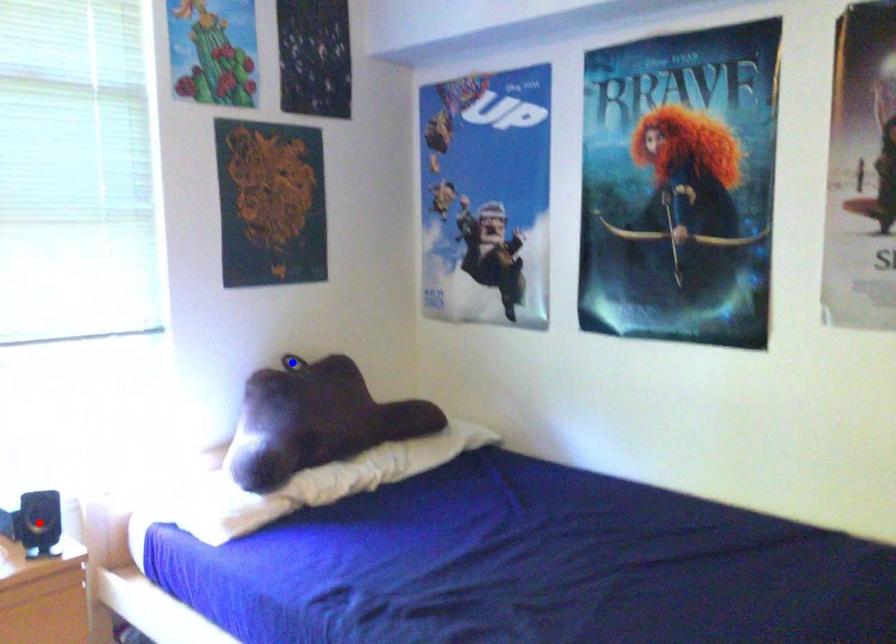
Question: Which of the two points in the image is closer to the camera?

Choices:
 (A) Blue point is closer.
 (B) Red point is closer.

Answer: (B)